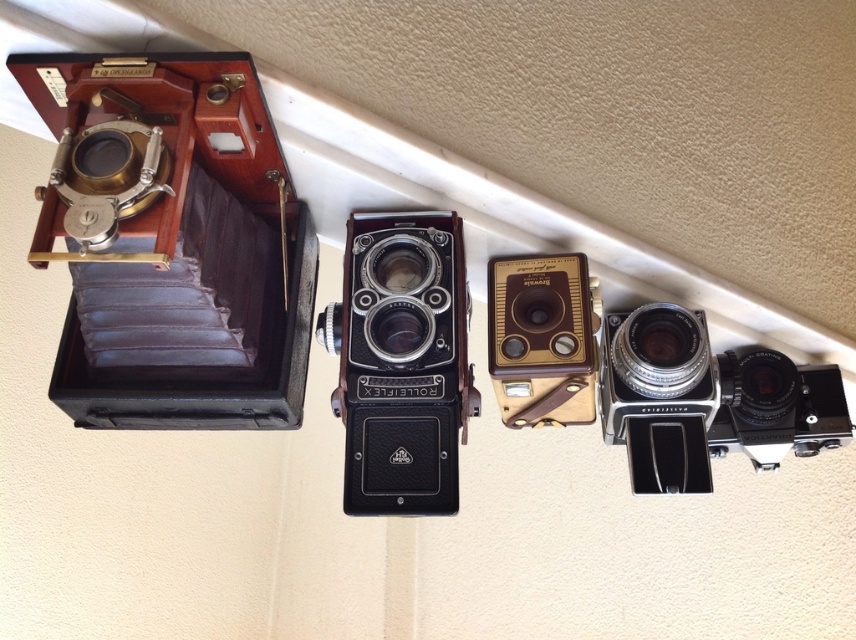
Is silver metallic camera at right closer to the viewer compared to gold metallic camera at center?

No.

Which is in front, point (783, 416) or point (544, 317)?

Point (544, 317) is more forward.

At what (x,y) coordinates should I click in order to perform the action: click on silver metallic camera at right. Please return your answer as a coordinate pair (x, y). This screenshot has width=856, height=640. Looking at the image, I should click on (706, 401).

Between black matte rolleiflex at center and gold metallic camera at center, which one is positioned lower?

black matte rolleiflex at center is lower down.

Does black matte rolleiflex at center appear on the right side of gold metallic camera at center?

No, black matte rolleiflex at center is not to the right of gold metallic camera at center.

Where is `black matte rolleiflex at center`? black matte rolleiflex at center is located at coordinates (401, 362).

Is black matte rolleiflex at center shorter than silver metallic camera at right?

In fact, black matte rolleiflex at center may be taller than silver metallic camera at right.

Is the position of black matte rolleiflex at center less distant than that of silver metallic camera at right?

Yes.

Is point (331, 321) less distant than point (708, 404)?

Yes.

You are a GUI agent. You are given a task and a screenshot of the screen. Output one action in this format:
    pyautogui.click(x=<x>, y=<y>)
    Task: Click on the black matte rolleiflex at center
    The width and height of the screenshot is (856, 640).
    Given the screenshot: What is the action you would take?
    click(401, 362)